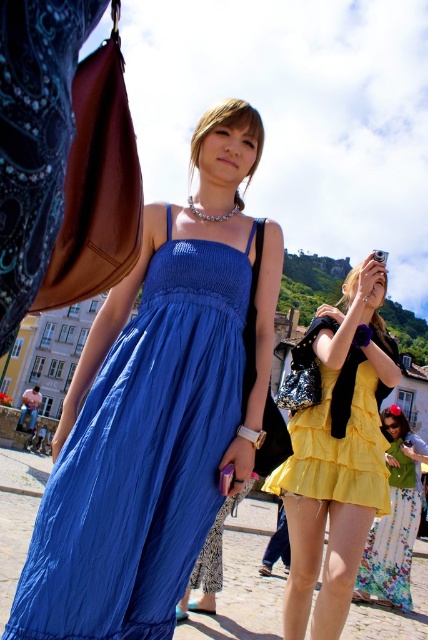
Question: From the image, what is the correct spatial relationship of matte blue dress at center in relation to yellow satin dress at center?

Choices:
 (A) left
 (B) right

Answer: (A)

Question: Considering the real-world distances, which object is farthest from the yellow satin dress at center?

Choices:
 (A) yellow floral skirt at lower right
 (B) matte blue dress at center

Answer: (A)

Question: Which point is closer to the camera?

Choices:
 (A) (376, 262)
 (B) (17, 596)

Answer: (B)

Question: Does matte blue dress at center have a larger size compared to yellow floral skirt at lower right?

Choices:
 (A) yes
 (B) no

Answer: (A)

Question: Which object is farther from the camera taking this photo?

Choices:
 (A) matte blue dress at center
 (B) yellow floral skirt at lower right

Answer: (B)

Question: Does matte blue dress at center appear on the left side of yellow floral skirt at lower right?

Choices:
 (A) no
 (B) yes

Answer: (B)